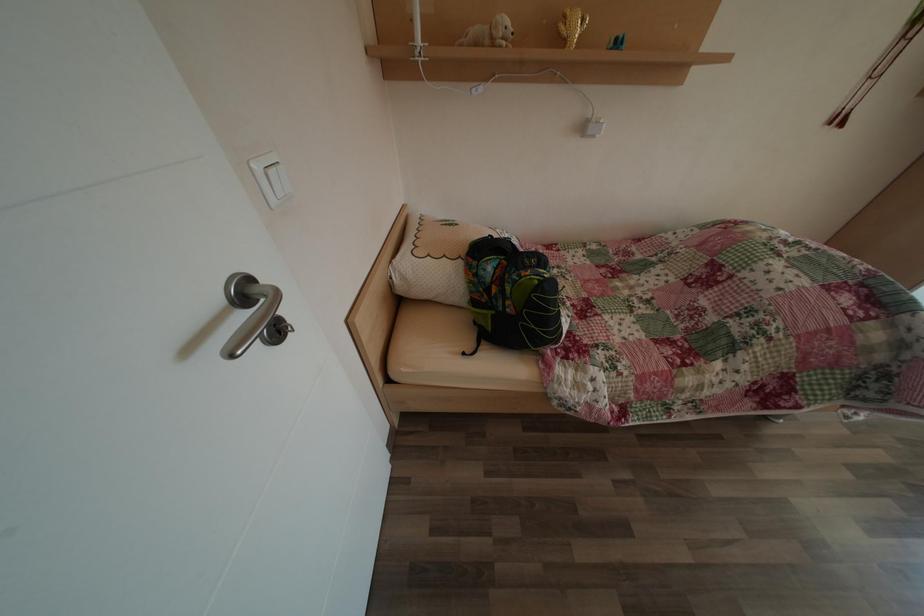
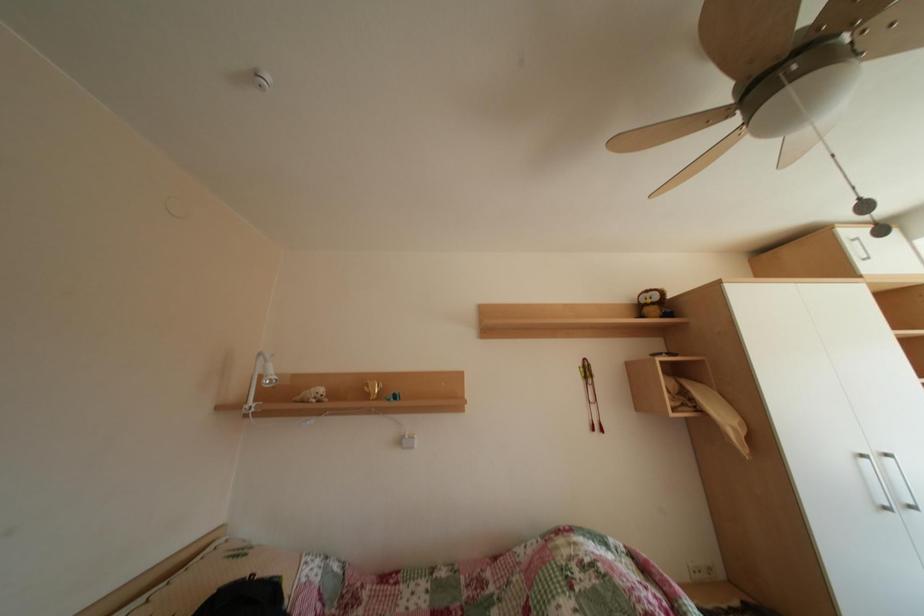
Question: The images are taken continuously from a first-person perspective. In which direction is your viewpoint rotating?

Choices:
 (A) Left
 (B) Right
 (C) Up
 (D) Down

Answer: (C)